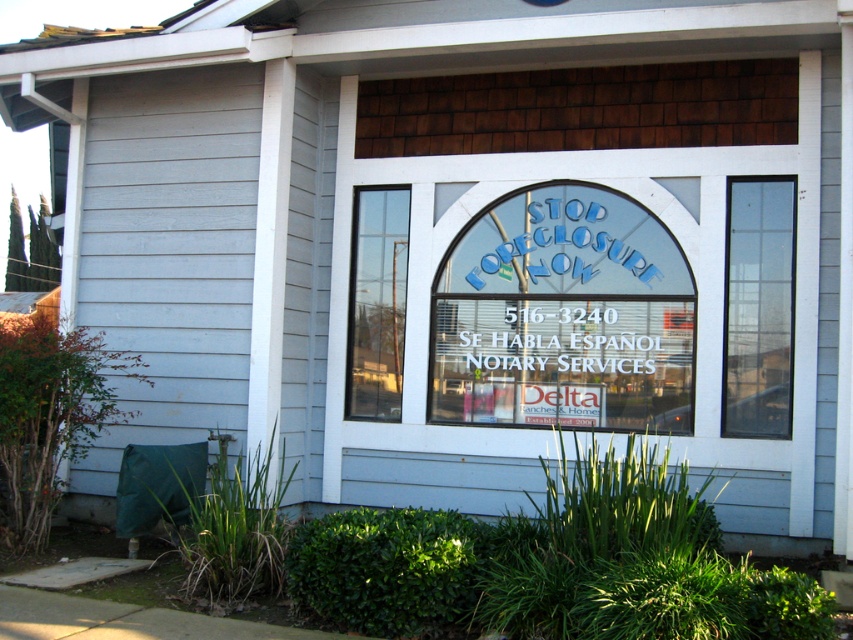
Question: Can you confirm if clear glass window at right is thinner than clear glass door at center?

Choices:
 (A) yes
 (B) no

Answer: (B)

Question: Among these objects, which one is nearest to the camera?

Choices:
 (A) clear glass window at right
 (B) white plastic sign at center

Answer: (A)

Question: Does white plastic sign at center appear on the right side of clear glass window at right?

Choices:
 (A) yes
 (B) no

Answer: (B)

Question: Is clear glass window at right positioned at the back of clear glass door at center?

Choices:
 (A) no
 (B) yes

Answer: (A)

Question: Among these objects, which one is nearest to the camera?

Choices:
 (A) clear glass window at right
 (B) white plastic sign at center

Answer: (A)

Question: Which of the following is the farthest from the observer?

Choices:
 (A) clear glass door at center
 (B) white plastic sign at center

Answer: (A)